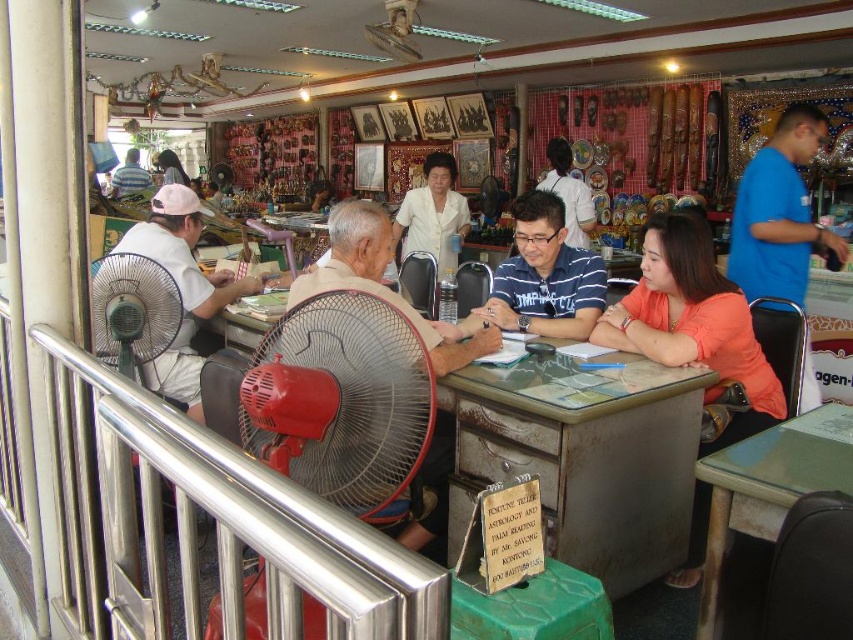
The image size is (853, 640). Describe the element at coordinates (770, 483) in the screenshot. I see `green plastic table at lower right` at that location.

Which is more to the right, green plastic table at lower right or blue striped polo shirt at center?

Positioned to the right is green plastic table at lower right.

Is point (842, 406) behind point (555, 300)?

No, it is not.

I want to click on green plastic table at lower right, so click(770, 483).

Is orange matte shirt at center bigger than matte blue shirt at left?

Yes, orange matte shirt at center is bigger than matte blue shirt at left.

Is orange matte shirt at center to the left of matte blue shirt at left from the viewer's perspective?

In fact, orange matte shirt at center is to the right of matte blue shirt at left.

Find the location of a particular element. This screenshot has height=640, width=853. orange matte shirt at center is located at coordinates (693, 321).

Who is positioned more to the right, red plastic fan at center or beige fabric shirt at center?

beige fabric shirt at center

Does red plastic fan at center have a lesser width compared to beige fabric shirt at center?

Yes.

Find the location of a particular element. The height and width of the screenshot is (640, 853). red plastic fan at center is located at coordinates (341, 403).